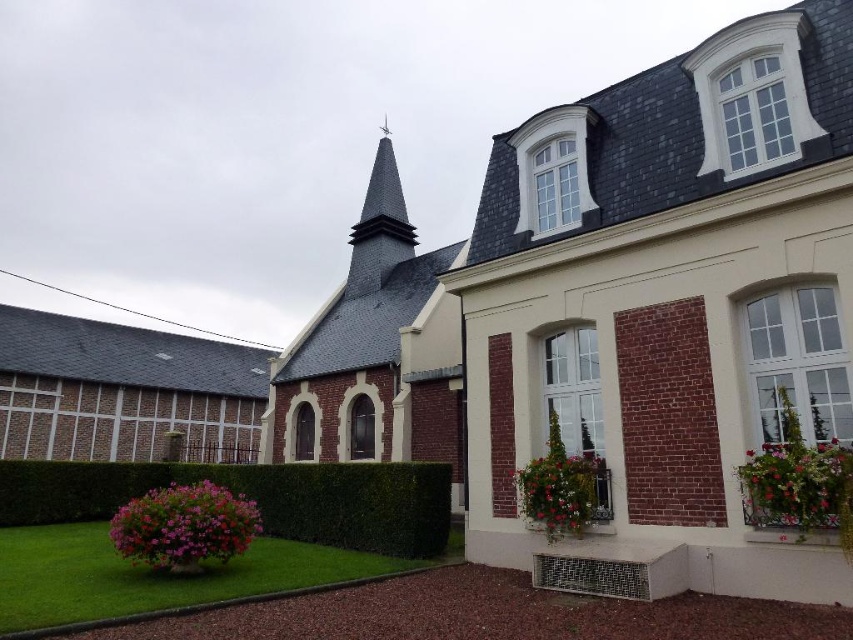
Question: Which object is positioned farthest from the green grass at lower left?

Choices:
 (A) brick steeple at center
 (B) floral arrangement at lower right
 (C) pink fabric flower at lower right
 (D) pink matte flower at lower left

Answer: (A)

Question: Is green grass at lower left above dark gray slate spire at center?

Choices:
 (A) no
 (B) yes

Answer: (A)

Question: Can you confirm if green leafy hedge at lower center is positioned above pink matte flower at lower left?

Choices:
 (A) yes
 (B) no

Answer: (B)

Question: Is brick steeple at center thinner than green grass at lower left?

Choices:
 (A) yes
 (B) no

Answer: (A)

Question: Which of the following is the farthest from the observer?

Choices:
 (A) brick steeple at center
 (B) floral arrangement at lower right
 (C) dark gray slate spire at center
 (D) pink matte flower at lower left

Answer: (C)

Question: Among these objects, which one is nearest to the camera?

Choices:
 (A) green grass at lower left
 (B) brick steeple at center
 (C) pink fabric flower at lower right

Answer: (A)